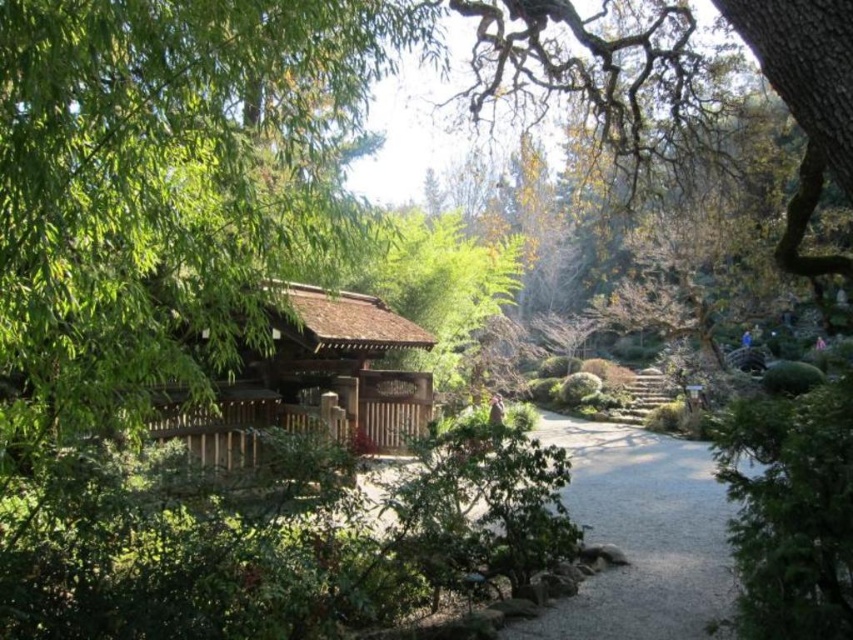
Between point (602, 593) and point (268, 412), which one is positioned in front?

Point (602, 593) is in front.

Which is more to the right, gray gravel path at center or brown wooden gazebo at center?

gray gravel path at center

Between point (564, 634) and point (373, 401), which one is positioned in front?

Positioned in front is point (564, 634).

Image resolution: width=853 pixels, height=640 pixels. What are the coordinates of `gray gravel path at center` in the screenshot? It's located at (639, 536).

Can you confirm if green leafy tree at left is smaller than gray gravel path at center?

Yes.

Is point (281, 131) closer to viewer compared to point (666, 557)?

Yes, point (281, 131) is closer to viewer.

Is point (225, 20) positioned behind point (611, 470)?

No, (225, 20) is closer to viewer.

This screenshot has height=640, width=853. In order to click on green leafy tree at left in this screenshot , I will do `click(163, 186)`.

Describe the element at coordinates (163, 186) in the screenshot. The width and height of the screenshot is (853, 640). I see `green leafy tree at left` at that location.

Consider the image. Measure the distance between green leafy tree at left and camera.

The distance of green leafy tree at left from camera is 2.61 meters.

Is point (99, 381) in front of point (334, 426)?

Yes, point (99, 381) is in front of point (334, 426).

Where is `green leafy tree at left`? The width and height of the screenshot is (853, 640). green leafy tree at left is located at coordinates (163, 186).